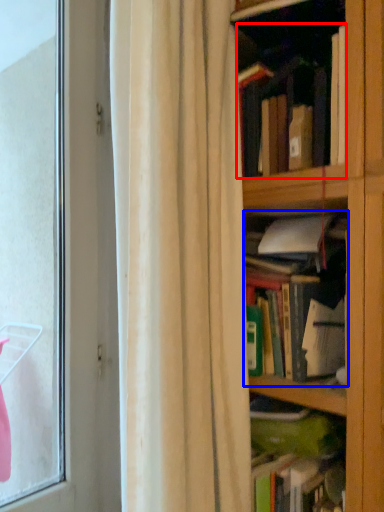
Question: Which point is closer to the camera, book (highlighted by a red box) or book (highlighted by a blue box)?

Choices:
 (A) book
 (B) book

Answer: (A)